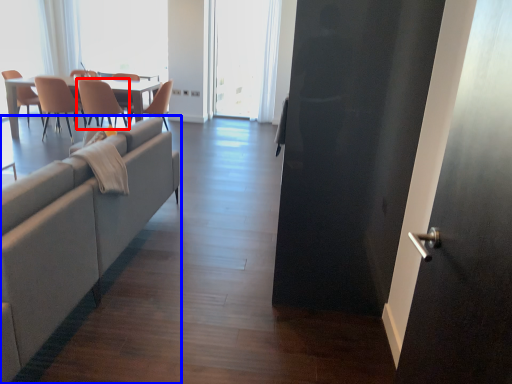
Question: Which object appears farthest to the camera in this image, chair (highlighted by a red box) or studio couch (highlighted by a blue box)?

Choices:
 (A) chair
 (B) studio couch

Answer: (A)